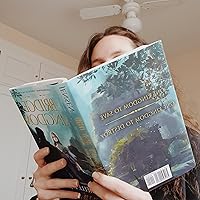
Locate an element on the screen. The height and width of the screenshot is (200, 200). cream colored ceiling in the background is located at coordinates (170, 23).